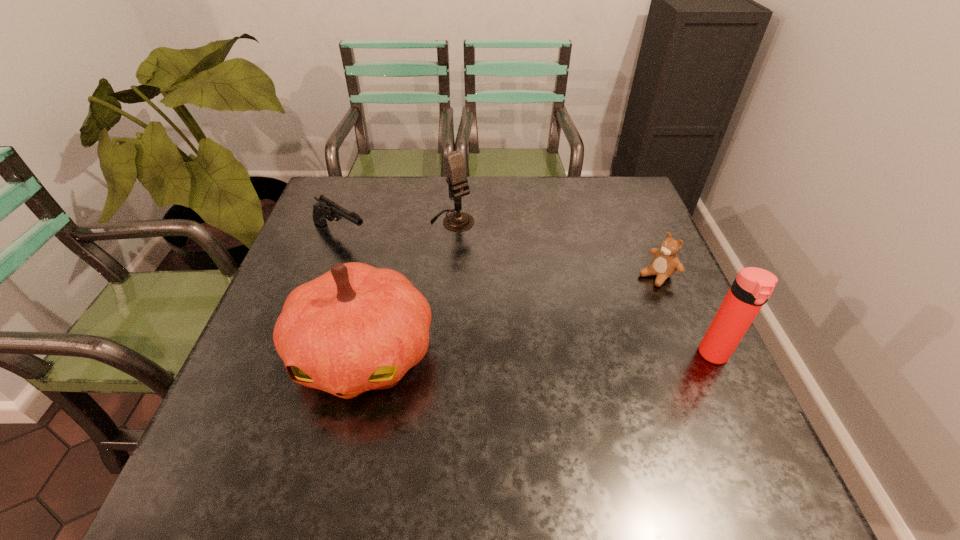
This screenshot has height=540, width=960. I want to click on thermos bottle present at the right edge, so click(x=752, y=287).

Where is `teddy bear that is positioned at the right edge`? The height and width of the screenshot is (540, 960). teddy bear that is positioned at the right edge is located at coordinates (665, 263).

I want to click on object that is at the far left corner, so click(x=325, y=209).

Find the location of a particular element. Image resolution: width=960 pixels, height=540 pixels. object that is at the near left corner is located at coordinates (356, 328).

Locate an element on the screen. vacant space at the far edge of the desktop is located at coordinates (500, 192).

Locate an element on the screen. The width and height of the screenshot is (960, 540). free spot at the near edge of the desktop is located at coordinates (310, 405).

I want to click on vacant space at the left edge of the desktop, so (x=345, y=221).

The height and width of the screenshot is (540, 960). In the image, there is a desktop. Identify the location of free space at the right edge. (693, 317).

In the image, there is a desktop. Where is `free region at the far left corner`? free region at the far left corner is located at coordinates (358, 204).

Identify the location of blank space at the far right corner. The height and width of the screenshot is (540, 960). (621, 185).